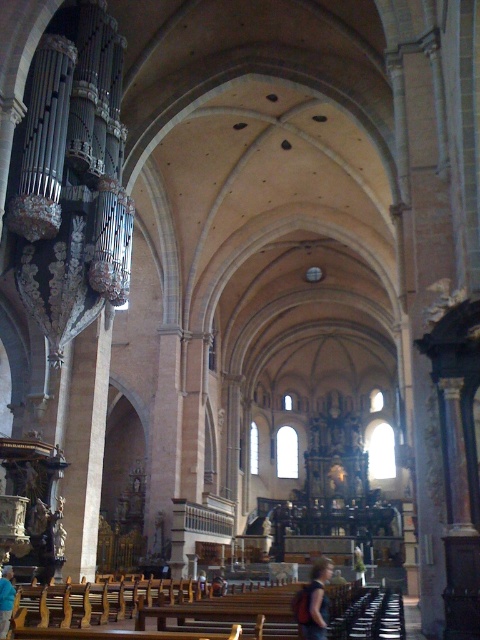
Measure the distance between dark brown leather jacket at lower center and camera.

They are 35.26 meters apart.

Consider the image. Between dark brown leather jacket at lower center and blue fabric shirt at lower left, which one has more height?

Standing taller between the two is dark brown leather jacket at lower center.

The image size is (480, 640). What are the coordinates of `dark brown leather jacket at lower center` in the screenshot? It's located at (313, 602).